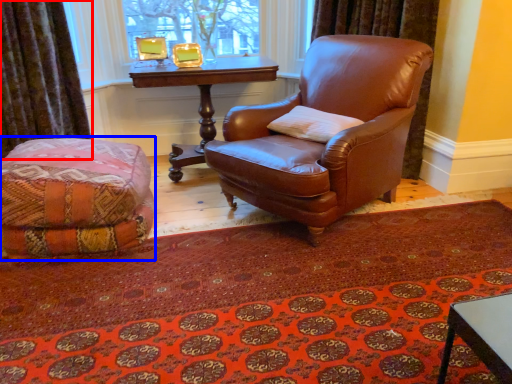
Question: Which of the following is the farthest to the observer, curtain (highlighted by a red box) or couch (highlighted by a blue box)?

Choices:
 (A) curtain
 (B) couch

Answer: (A)